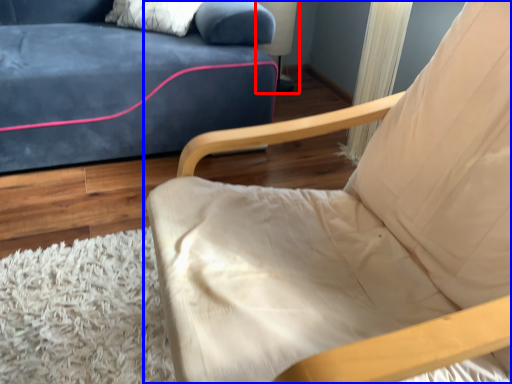
Question: Which of the following is the closest to the observer, table lamp (highlighted by a red box) or chair (highlighted by a blue box)?

Choices:
 (A) table lamp
 (B) chair

Answer: (B)